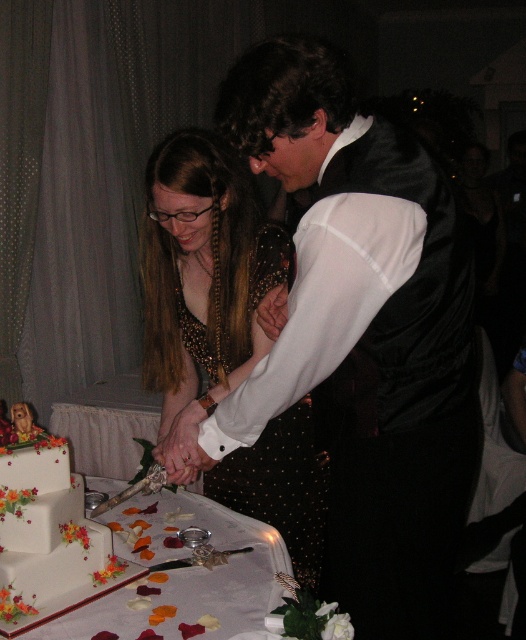
You are a photographer at the wedding reception and need to position yourself so that both the point at (369, 260) and the point at (7, 557) are visible in your shot. Based on their spatial relationship, which point should you prioritize placing closer to the front of the frame?

You should prioritize placing the point at (369, 260) closer to the front of the frame because it is in front of the point at (7, 557).